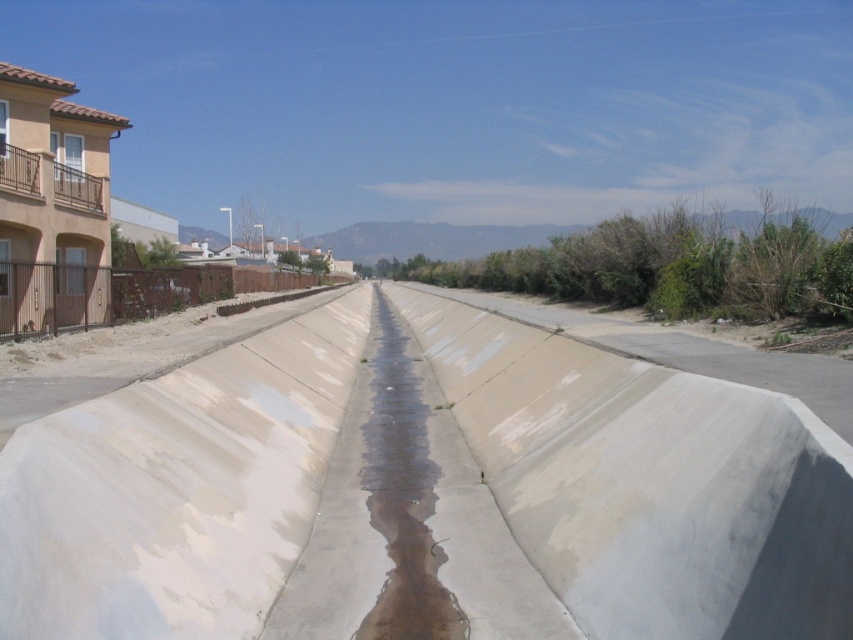
Is smooth concrete at center to the right of clear concrete puddle at center from the viewer's perspective?

Yes, smooth concrete at center is to the right of clear concrete puddle at center.

Does smooth concrete at center appear over clear concrete puddle at center?

Yes, smooth concrete at center is above clear concrete puddle at center.

Describe the element at coordinates (426, 490) in the screenshot. This screenshot has height=640, width=853. I see `smooth concrete at center` at that location.

Identify the location of smooth concrete at center. The width and height of the screenshot is (853, 640). (426, 490).